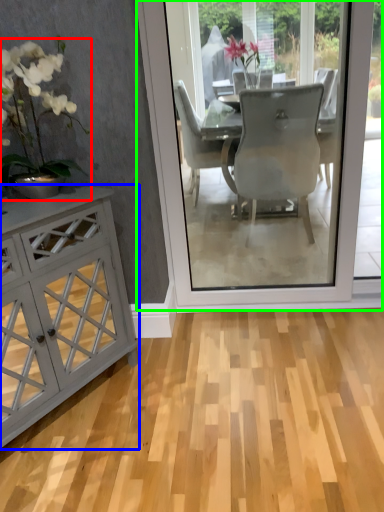
Question: Estimate the real-world distances between objects in this image. Which object is farther from houseplant (highlighted by a red box), cabinetry (highlighted by a blue box) or screen door (highlighted by a green box)?

Choices:
 (A) cabinetry
 (B) screen door

Answer: (B)